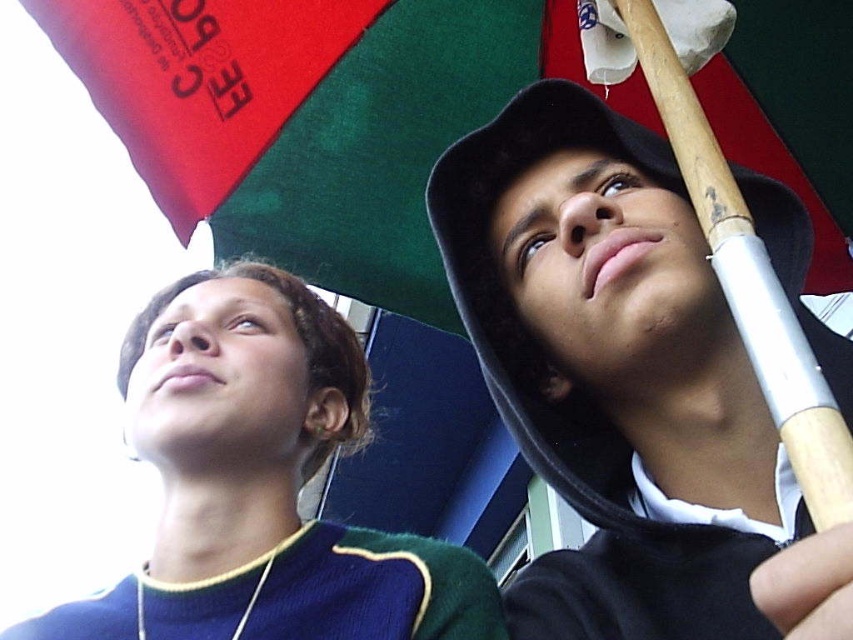
Which is above, dark blue sweater at upper left or wooden baseball bat at right?

wooden baseball bat at right is above.

Does dark blue sweater at upper left appear over wooden baseball bat at right?

No, dark blue sweater at upper left is not above wooden baseball bat at right.

This screenshot has height=640, width=853. In order to click on dark blue sweater at upper left in this screenshot , I will do pos(260,483).

Which is behind, point (213, 202) or point (822, 412)?

Point (213, 202)

Does point (766, 132) come in front of point (770, 349)?

No, it is behind (770, 349).

What do you see at coordinates (306, 118) in the screenshot?
I see `green fabric umbrella at upper center` at bounding box center [306, 118].

Where is `green fabric umbrella at upper center`? This screenshot has height=640, width=853. green fabric umbrella at upper center is located at coordinates (306, 118).

Which of these two, black matte baseball cap at upper center or wooden baseball bat at right, stands taller?

Standing taller between the two is black matte baseball cap at upper center.

Does black matte baseball cap at upper center have a larger size compared to wooden baseball bat at right?

Yes, black matte baseball cap at upper center is bigger than wooden baseball bat at right.

This screenshot has width=853, height=640. Identify the location of black matte baseball cap at upper center. (625, 385).